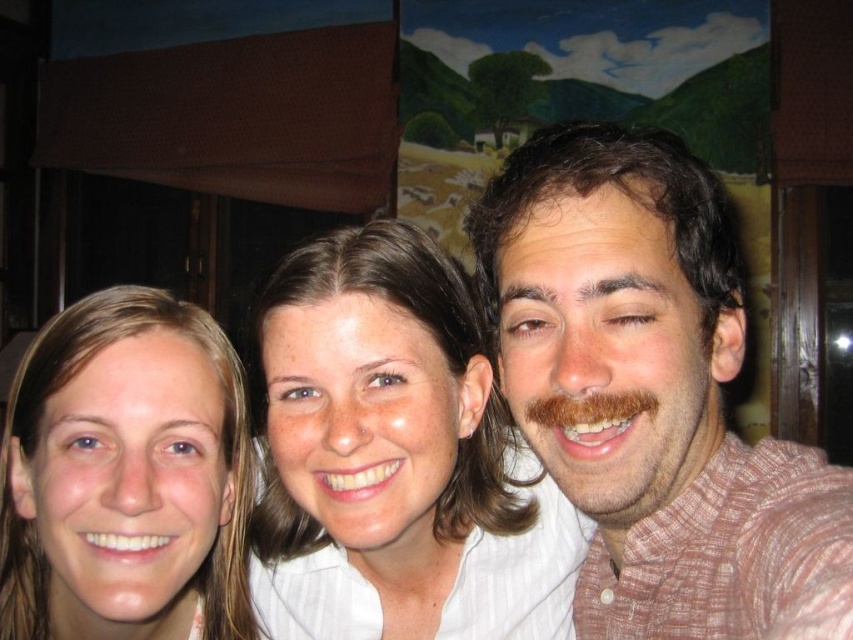
You are a photographer trying to adjust the lighting for a group photo. You notice the brown hair at right and the smooth skin face at center. Which of these two has a greater width in the image?

The brown hair at right has a greater width than the smooth skin face at center according to the description.

You are a photographer trying to adjust the lighting for a group photo. You notice the brown hair at right and the smooth skin face at center. Which one is located to the right of the other?

The brown hair at right is positioned on the right side of smooth skin face at center, so the brown hair at right is to the right of the smooth skin face at center.

You are standing in front of the photograph and want to touch the point at coordinates point (403,298). Considering your arm can reach 24 inches, will you be able to reach it?

The point (403,298) is 22.88 inches from the viewer, so yes, you can reach it since your arm can extend 24 inches which is longer than the distance required.